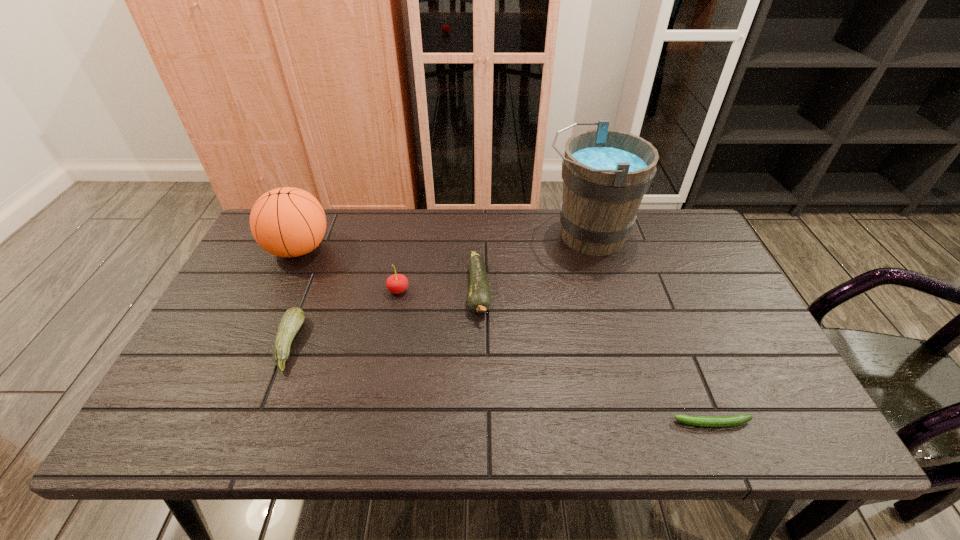
Find the location of a particular element. This screenshot has width=960, height=540. vacant area situated 0.100m with a handle on the side of the wine bucket is located at coordinates (510, 235).

At what (x,y) coordinates should I click in order to perform the action: click on free region located 0.300m with a handle on the side of the wine bucket. Please return your answer as a coordinate pair (x, y). This screenshot has width=960, height=540. Looking at the image, I should click on pos(447,235).

Where is `free spot located 0.370m with a handle on the side of the wine bucket`? free spot located 0.370m with a handle on the side of the wine bucket is located at coordinates (425, 235).

Image resolution: width=960 pixels, height=540 pixels. What are the coordinates of `vacant point located 0.130m on the right of the fifth shortest object` in the screenshot? It's located at (374, 248).

This screenshot has height=540, width=960. In order to click on vacant area located 0.110m on the right of the fourth shortest object in this screenshot , I will do `click(448, 291)`.

The width and height of the screenshot is (960, 540). I want to click on free space located 0.280m at the blossom end of the third shortest object, so click(x=479, y=426).

In order to click on vacant region located 0.160m at the stem end of the second shortest zucchini in this screenshot , I will do `click(364, 343)`.

Locate an element on the screen. free space located on the front-facing side of the shortest zucchini is located at coordinates (552, 423).

Where is `free space located 0.320m on the front-facing side of the shortest zucchini`? The width and height of the screenshot is (960, 540). free space located 0.320m on the front-facing side of the shortest zucchini is located at coordinates (524, 423).

Where is `vacant area located 0.210m on the front-facing side of the shortest zucchini`? vacant area located 0.210m on the front-facing side of the shortest zucchini is located at coordinates (575, 423).